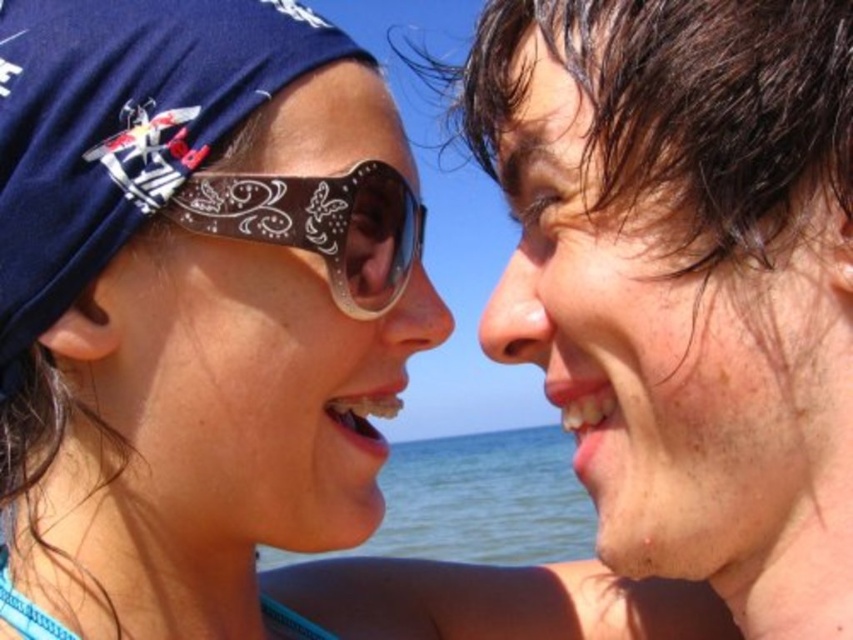
You are a photographer adjusting your camera settings to capture the best shot of the two people in the scene. You notice the dry skin face at right and the matte black sunglasses at left. Which object is positioned closer to your camera lens?

The dry skin face at right is closer to the viewer than the matte black sunglasses at left, so the dry skin face at right would be closer to the camera lens.